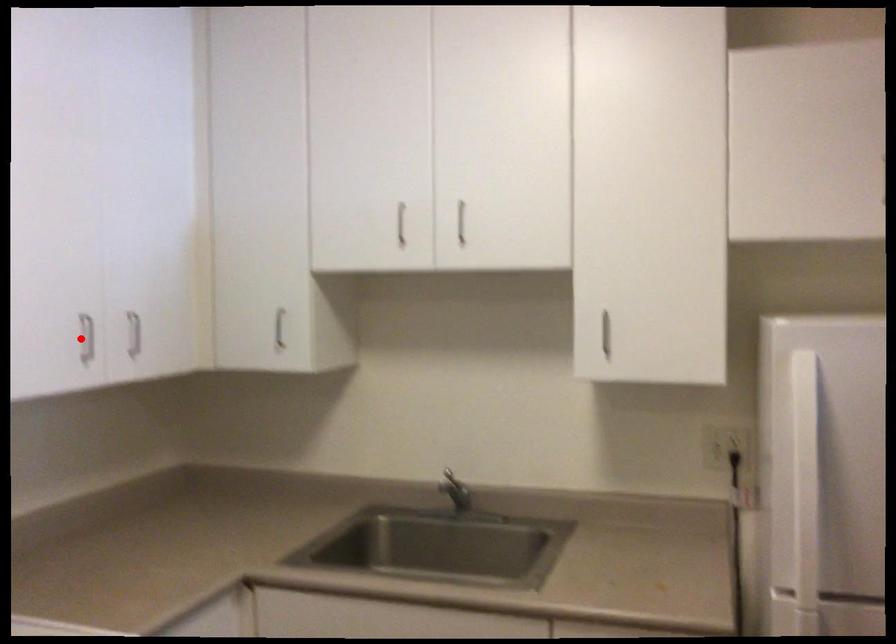
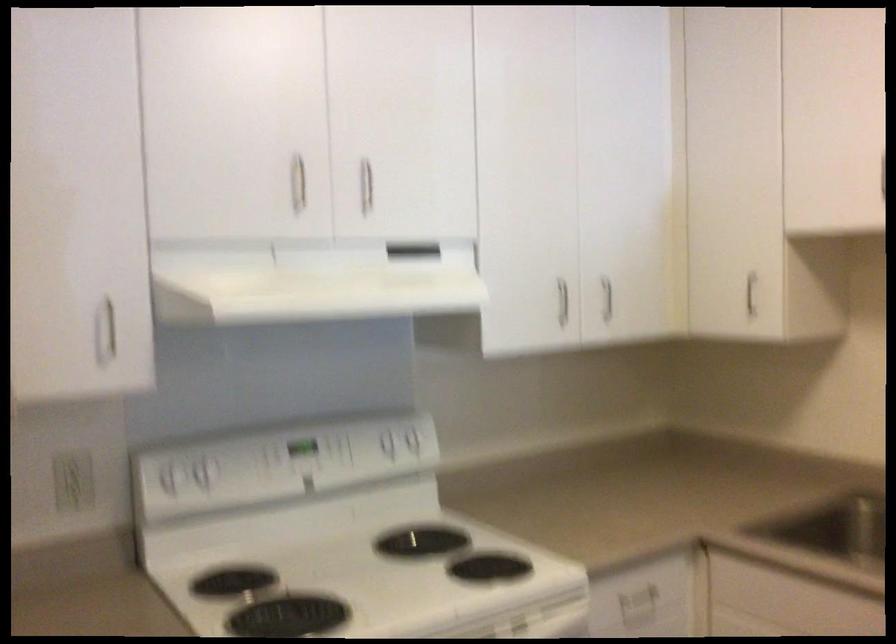
Question: I am providing you with two images of the same scene from different viewpoints. In image1, a red point is highlighted. Considering the same 3D point in image2, which of the following is correct?

Choices:
 (A) It is closer
 (B) It is farther

Answer: (B)